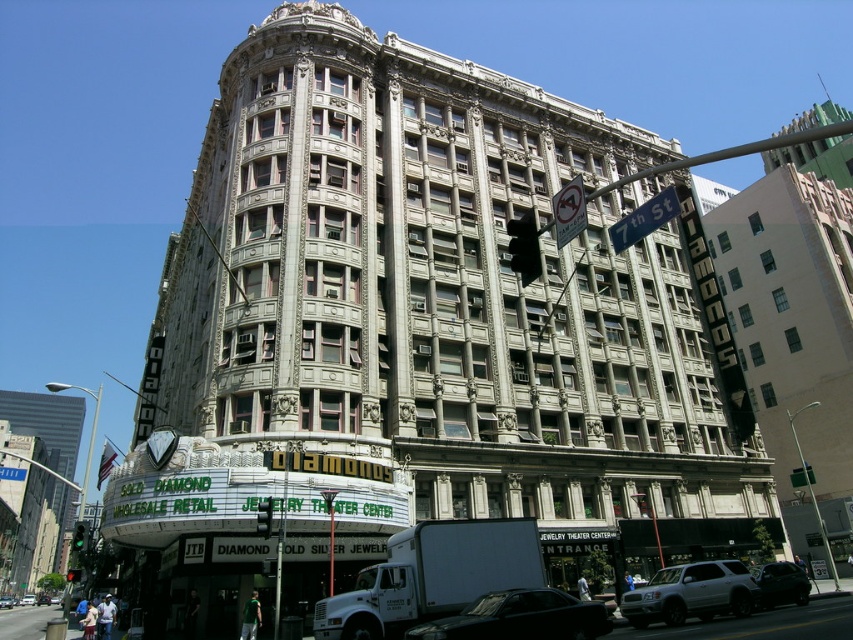
Question: Which object is positioned closest to the red glass traffic light at upper center?

Choices:
 (A) black glass traffic light at center
 (B) green glass traffic light at center
 (C) shiny black sedan at center
 (D) metallic rectangular sign at upper center

Answer: (B)

Question: Can you confirm if green glass traffic light at center is positioned below green glass traffic light at upper center?

Choices:
 (A) no
 (B) yes

Answer: (A)

Question: Observing the image, what is the correct spatial positioning of shiny black car at lower right in reference to black glass traffic light at center?

Choices:
 (A) left
 (B) right

Answer: (B)

Question: Which object appears closest to the camera in this image?

Choices:
 (A) metallic rectangular sign at upper center
 (B) metallic silver car at center

Answer: (A)

Question: Is shiny black sedan at center positioned in front of blue metal street sign at upper center?

Choices:
 (A) yes
 (B) no

Answer: (B)

Question: Among these points, which one is farthest from the camera?

Choices:
 (A) (611, 241)
 (B) (699, 563)

Answer: (A)